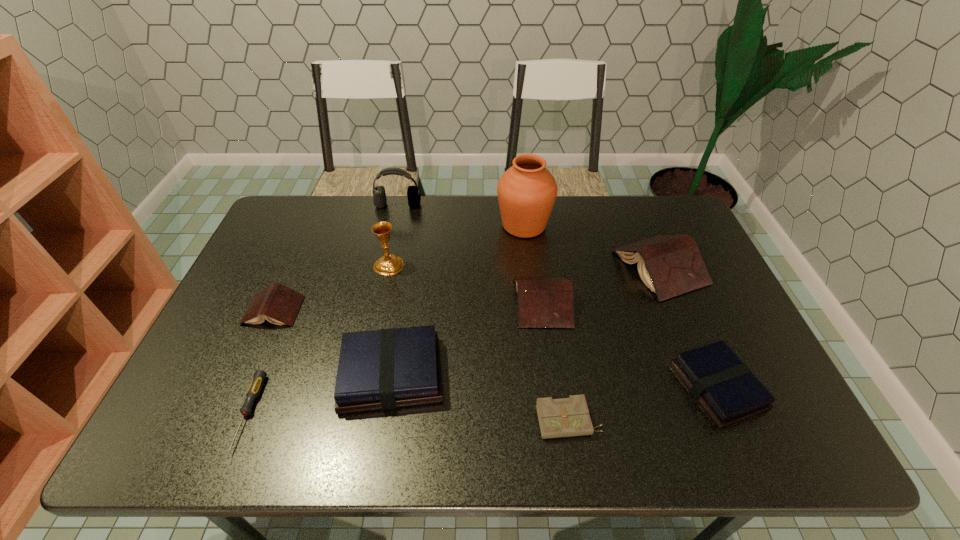
This screenshot has width=960, height=540. Identify the location of the leftmost book. (278, 304).

What are the coordinates of `the smallest brown book` in the screenshot? It's located at (278, 304).

This screenshot has width=960, height=540. Identify the location of the right blue book. (725, 387).

Where is `the ninth tallest object`? the ninth tallest object is located at coordinates (566, 417).

Where is `diary`? The height and width of the screenshot is (540, 960). diary is located at coordinates (566, 417).

This screenshot has height=540, width=960. Identify the location of screwdriver. (258, 379).

The image size is (960, 540). I want to click on vacant area situated on the front of the brown urn, so click(533, 305).

Where is `free spot located 0.110m on the headband of the headset`? The height and width of the screenshot is (540, 960). free spot located 0.110m on the headband of the headset is located at coordinates (393, 229).

Locate an element on the screen. The height and width of the screenshot is (540, 960). free region located 0.280m on the back of the chalice is located at coordinates (402, 202).

This screenshot has width=960, height=540. I want to click on free space located 0.100m on the left of the rightmost brown book, so click(583, 267).